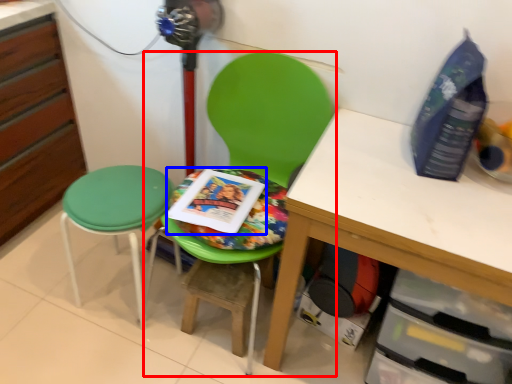
Question: Which of the following is the closest to the observer, chair (highlighted by a red box) or paperback book (highlighted by a blue box)?

Choices:
 (A) chair
 (B) paperback book

Answer: (A)